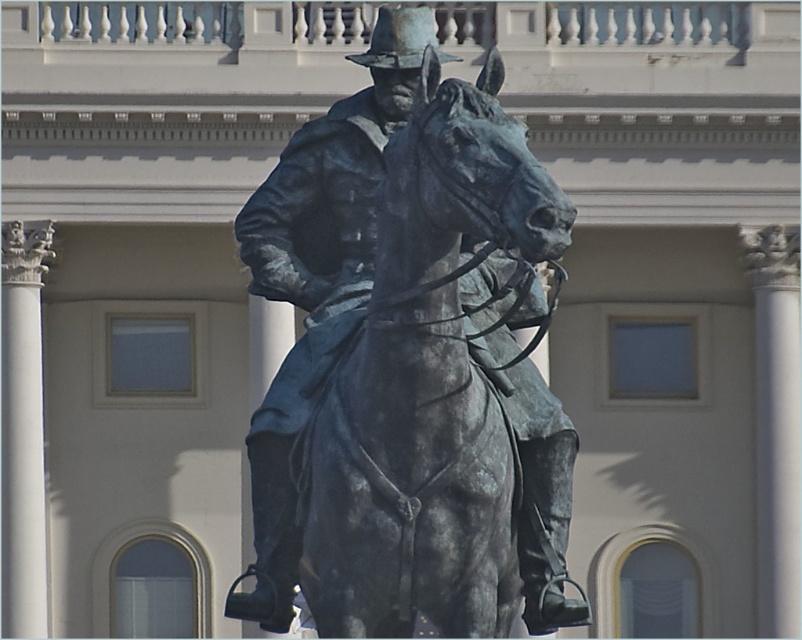
Question: Which object is farther from the camera taking this photo?

Choices:
 (A) shiny bronze cowboy hat at center
 (B) bronze statue at center

Answer: (A)

Question: Which point appears closest to the camera in this image?

Choices:
 (A) (300, 406)
 (B) (391, 44)

Answer: (A)

Question: Does bronze statue at center appear on the left side of shiny bronze cowboy hat at center?

Choices:
 (A) yes
 (B) no

Answer: (A)

Question: Is bronze statue at center wider than shiny bronze cowboy hat at center?

Choices:
 (A) yes
 (B) no

Answer: (A)

Question: Is bronze statue at center wider than shiny bronze cowboy hat at center?

Choices:
 (A) no
 (B) yes

Answer: (B)